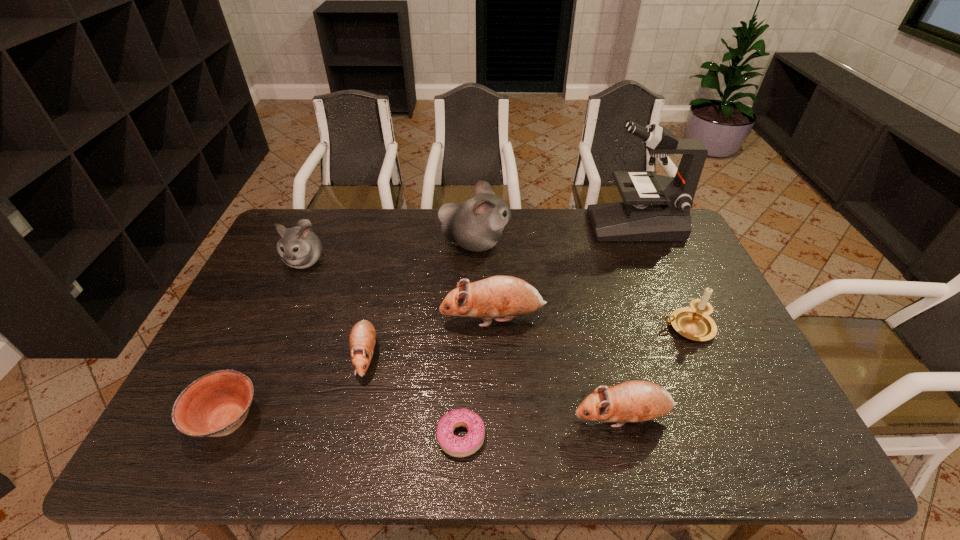
This screenshot has height=540, width=960. In order to click on vacant space situated 0.140m at the face of the second brown hamster from right to left in this screenshot , I will do `click(393, 319)`.

This screenshot has height=540, width=960. Find the location of `free space located at the face of the second brown hamster from right to left`. free space located at the face of the second brown hamster from right to left is located at coordinates (308, 319).

Locate an element on the screen. The image size is (960, 540). free region located 0.080m with a handle on the side of the beige candle holder is located at coordinates (633, 327).

This screenshot has width=960, height=540. In order to click on blank area located with a handle on the side of the beige candle holder in this screenshot , I will do `click(544, 327)`.

This screenshot has height=540, width=960. What are the coordinates of `free region located 0.130m with a handle on the side of the beige candle holder` in the screenshot? It's located at (615, 327).

Image resolution: width=960 pixels, height=540 pixels. Identify the location of vacant space located at the face of the rightmost brown hamster. (431, 418).

Image resolution: width=960 pixels, height=540 pixels. Identify the location of vacant space located at the face of the rightmost brown hamster. (482, 418).

At what (x,y) coordinates should I click in order to perform the action: click on vacant area situated at the face of the rightmost brown hamster. Please return your answer as a coordinate pair (x, y). Image resolution: width=960 pixels, height=540 pixels. Looking at the image, I should click on (512, 418).

Image resolution: width=960 pixels, height=540 pixels. Find the location of `free space located at the face of the shortest hamster`. free space located at the face of the shortest hamster is located at coordinates (348, 429).

Identify the location of vacant position located 0.130m on the back of the bowl. This screenshot has height=540, width=960. (261, 348).